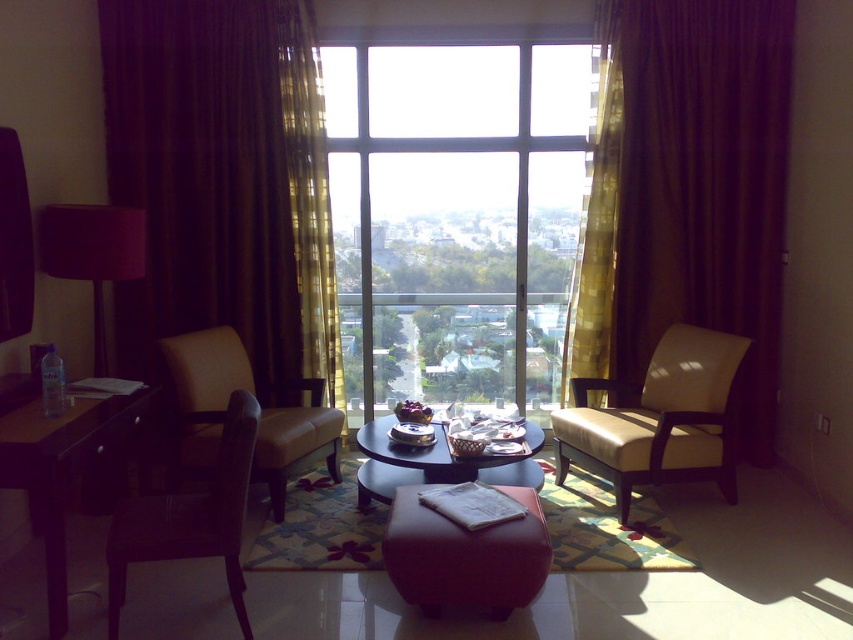
Question: Does leather ottoman at center lie in front of brown wooden table at left?

Choices:
 (A) no
 (B) yes

Answer: (A)

Question: Where is brown sheer curtain at left located in relation to leather ottoman at center in the image?

Choices:
 (A) left
 (B) right

Answer: (A)

Question: Which of these objects is positioned closest to the matte black lampshade at left?

Choices:
 (A) translucent yellow curtain at center
 (B) transparent glass window at center
 (C) transparent glass table at center

Answer: (A)

Question: Which object is the farthest from the beige leather armchair at right?

Choices:
 (A) matte black lampshade at left
 (B) brown wooden table at left
 (C) translucent yellow fabric at right

Answer: (A)

Question: Among these points, which one is farthest from the camera?

Choices:
 (A) click(631, 420)
 (B) click(84, 262)
 (C) click(148, 410)

Answer: (A)

Question: From the image, what is the correct spatial relationship of leather ottoman at center in relation to translucent yellow fabric at right?

Choices:
 (A) right
 (B) left

Answer: (B)